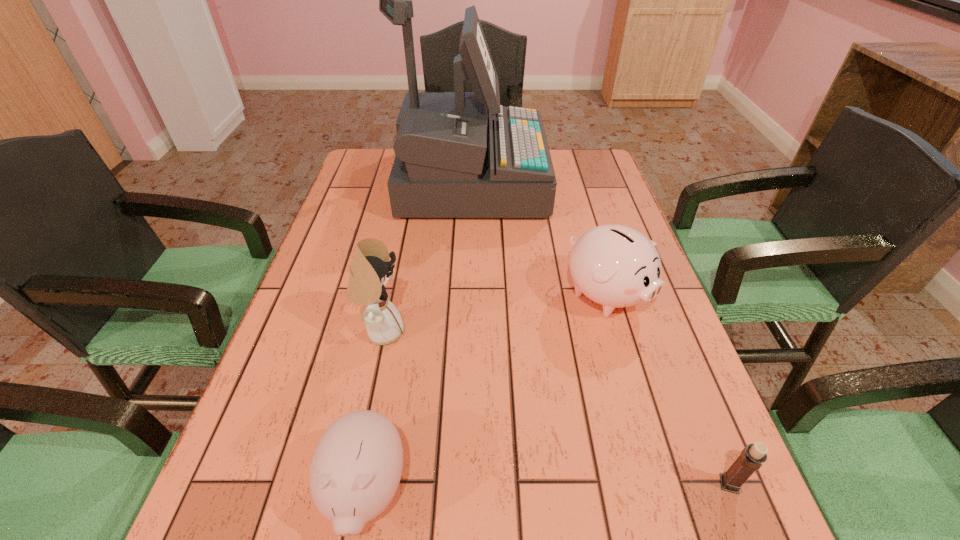
You are a GUI agent. You are given a task and a screenshot of the screen. Output one action in this format:
    pyautogui.click(x=<x>, y=<y>)
    Task: Click on the object positioned at the far edge
    Image resolution: width=960 pixels, height=540 pixels.
    Given the screenshot: What is the action you would take?
    pyautogui.click(x=452, y=160)

Identify the location of cash register that is at the left edge. Image resolution: width=960 pixels, height=540 pixels. click(452, 160).

This screenshot has height=540, width=960. I want to click on doll that is positioned at the left edge, so click(x=370, y=270).

Where is `piggy bank that is at the right edge`? This screenshot has height=540, width=960. piggy bank that is at the right edge is located at coordinates pyautogui.click(x=616, y=266).

Locate an element on the screen. The width and height of the screenshot is (960, 540). candle holder present at the right edge is located at coordinates (751, 458).

The height and width of the screenshot is (540, 960). In order to click on object that is at the far left corner in this screenshot , I will do `click(452, 160)`.

This screenshot has height=540, width=960. In the image, there is a desktop. Find the location of `vacant space at the left edge`. vacant space at the left edge is located at coordinates (371, 229).

What are the coordinates of `vacant space at the right edge` in the screenshot? It's located at (595, 227).

Where is `empty space that is in between the fourth shortest object and the taller piggy bank`? The width and height of the screenshot is (960, 540). empty space that is in between the fourth shortest object and the taller piggy bank is located at coordinates (493, 313).

Locate an element on the screen. vacant space that's between the candle holder and the doll is located at coordinates (555, 408).